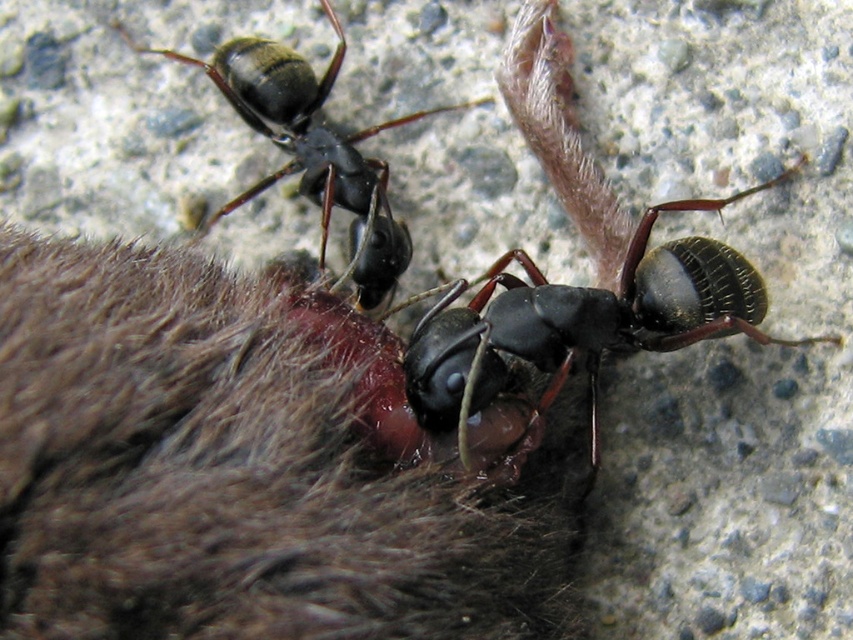
Question: Can you confirm if brown fuzzy fur at center is thinner than shiny black ant at center?

Choices:
 (A) yes
 (B) no

Answer: (B)

Question: Does shiny black ant at center appear over shiny black ant at upper left?

Choices:
 (A) no
 (B) yes

Answer: (A)

Question: Which of these objects is positioned farthest from the shiny black ant at center?

Choices:
 (A) shiny black ant at upper left
 (B) brown fuzzy fur at center

Answer: (A)

Question: Which point is closer to the camera?

Choices:
 (A) (651, 278)
 (B) (381, 282)
 (C) (376, 625)

Answer: (C)

Question: Which of the following is the closest to the observer?

Choices:
 (A) (456, 486)
 (B) (749, 330)

Answer: (A)

Question: Is brown fuzzy fur at center wider than shiny black ant at center?

Choices:
 (A) no
 (B) yes

Answer: (B)